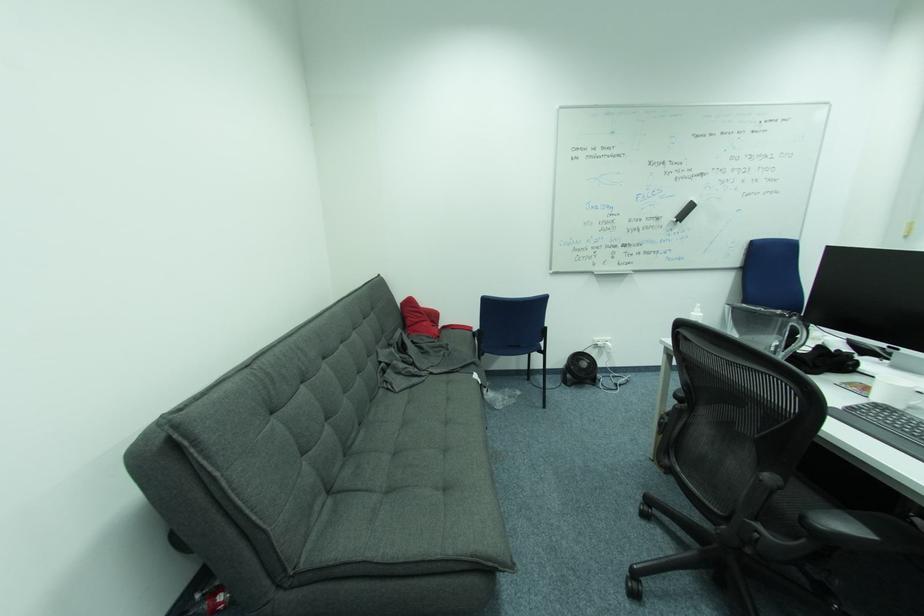
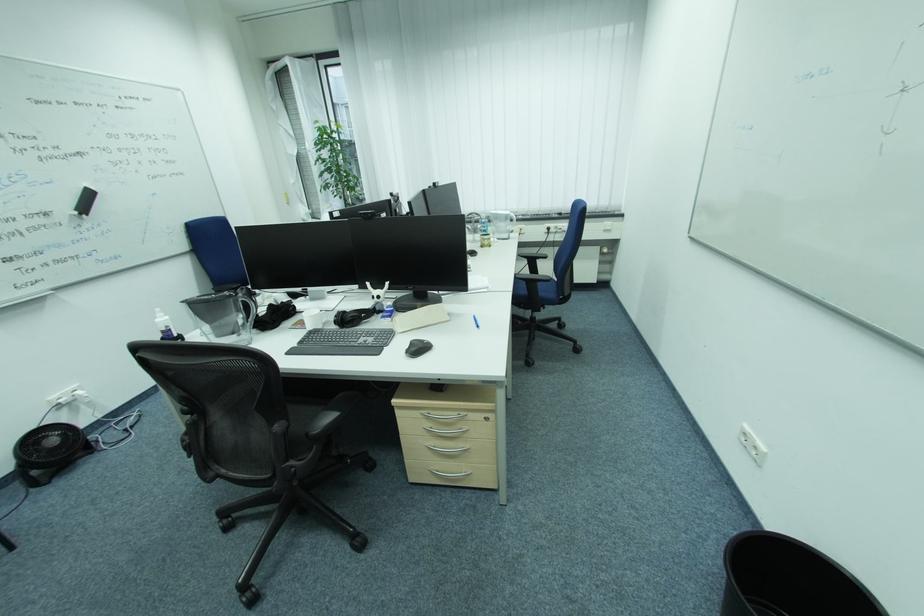
In the second image, find the point that corresponds to (699,314) in the first image.

(164, 321)